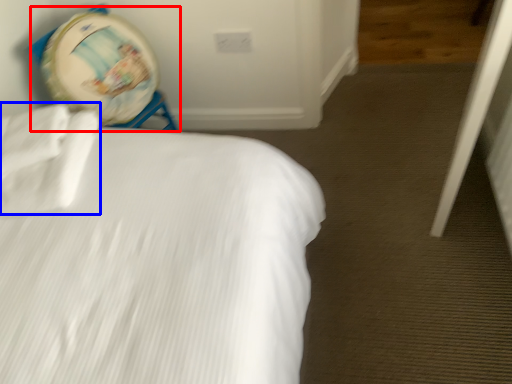
Question: Which of the following is the closest to the observer, swivel chair (highlighted by a red box) or sheet (highlighted by a blue box)?

Choices:
 (A) swivel chair
 (B) sheet

Answer: (B)